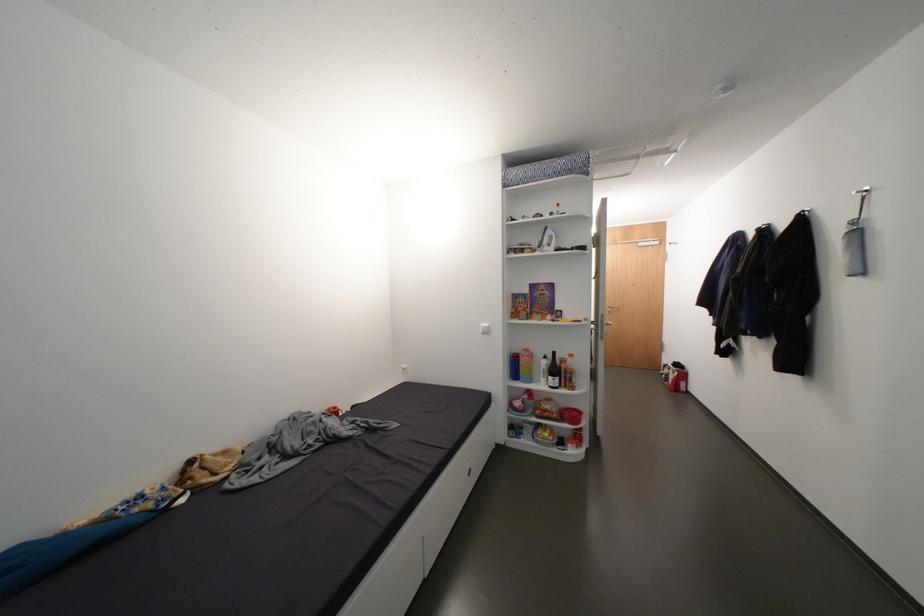
Find the location of a particular element. white steam iron is located at coordinates (546, 240).